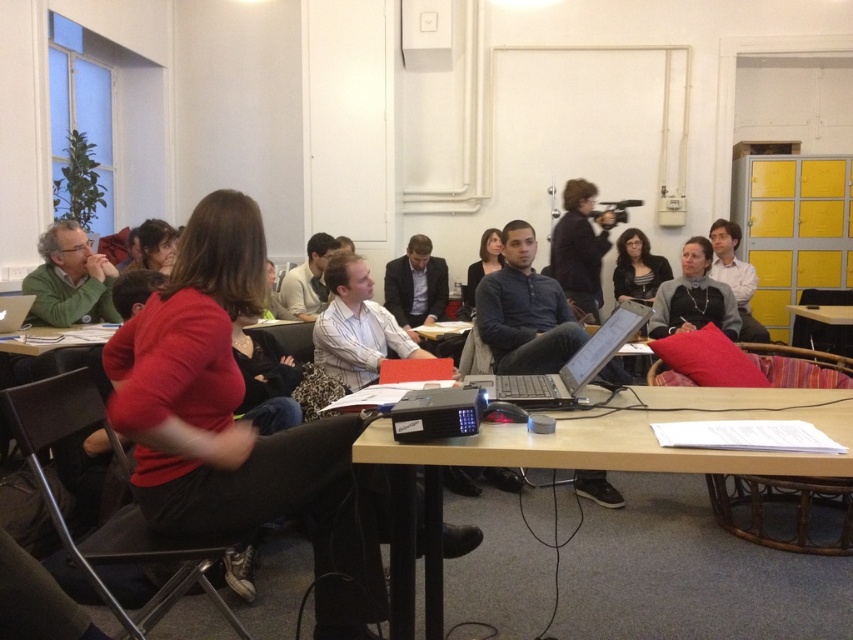
You are sitting at the back row of the classroom and want to see the projector screen clearly. The silver metallic laptop at center is blocking your view. Can you move the laptop to the left or right to improve your view?

The silver metallic laptop at center is located at point (566, 364). Moving it to the left or right might help, but since the exact position of the projector screen isn

You are a student sitting in the classroom and you want to hand in your assignment to the professor. The professor is wearing the matte gray sweater at center. Where should you go to find the professor?

The professor wearing the matte gray sweater at center is located at point (693, 296). You should go to that location to find them.